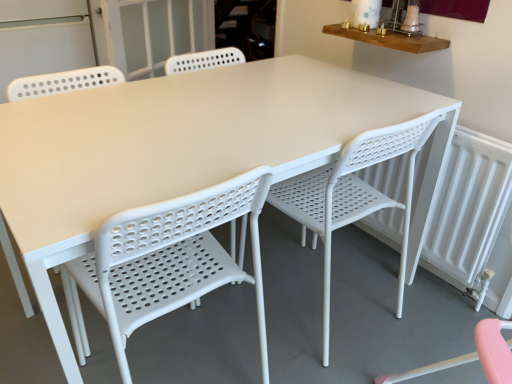
Question: Is white perforated plastic chair at center, arranged as the 2th chair when viewed from the right, far away from transparent glass screen door at upper center, marked as the 2th screen door in a left-to-right arrangement?

Choices:
 (A) no
 (B) yes

Answer: (B)

Question: Is white perforated plastic chair at center, arranged as the 2th chair when viewed from the right, outside transparent glass screen door at upper center, marked as the 2th screen door in a left-to-right arrangement?

Choices:
 (A) yes
 (B) no

Answer: (A)

Question: Can you confirm if white perforated plastic chair at center, arranged as the first chair when viewed from the left, is positioned to the right of transparent glass screen door at upper center, marked as the 2th screen door in a left-to-right arrangement?

Choices:
 (A) yes
 (B) no

Answer: (A)

Question: Is white perforated plastic chair at center, arranged as the 2th chair when viewed from the right, turned away from transparent glass screen door at upper center, marked as the 2th screen door in a left-to-right arrangement?

Choices:
 (A) yes
 (B) no

Answer: (B)

Question: Is transparent glass screen door at upper center, the first screen door from the right, a part of white perforated plastic chair at center, arranged as the first chair when viewed from the left?

Choices:
 (A) yes
 (B) no

Answer: (B)

Question: Relative to transparent glass screen door at upper center, the first screen door from the right, is white perforated plastic chair at center, arranged as the 2th chair when viewed from the right, in front or behind?

Choices:
 (A) behind
 (B) front

Answer: (B)

Question: Is point click(188, 228) closer or farther from the camera than point click(121, 4)?

Choices:
 (A) closer
 (B) farther

Answer: (A)

Question: From the image's perspective, is white perforated plastic chair at center, arranged as the 2th chair when viewed from the right, located above or below transparent glass screen door at upper center, the first screen door from the right?

Choices:
 (A) below
 (B) above

Answer: (A)

Question: Is white perforated plastic chair at center, arranged as the first chair when viewed from the left, spatially inside transparent glass screen door at upper center, marked as the 2th screen door in a left-to-right arrangement, or outside of it?

Choices:
 (A) inside
 (B) outside

Answer: (B)

Question: Considering the relative positions of transparent glass screen door at upper center, the first screen door from the right, and white perforated screen door at upper left, placed as the first screen door when sorted from left to right, in the image provided, is transparent glass screen door at upper center, the first screen door from the right, to the left or to the right of white perforated screen door at upper left, placed as the first screen door when sorted from left to right,?

Choices:
 (A) right
 (B) left

Answer: (A)

Question: From a real-world perspective, is transparent glass screen door at upper center, marked as the 2th screen door in a left-to-right arrangement, positioned above or below white perforated screen door at upper left, placed as the first screen door when sorted from left to right?

Choices:
 (A) below
 (B) above

Answer: (B)

Question: Is transparent glass screen door at upper center, the first screen door from the right, taller or shorter than white perforated screen door at upper left, the second screen door in the right-to-left sequence?

Choices:
 (A) tall
 (B) short

Answer: (B)

Question: From the image's perspective, is transparent glass screen door at upper center, marked as the 2th screen door in a left-to-right arrangement, positioned above or below white perforated screen door at upper left, the second screen door in the right-to-left sequence?

Choices:
 (A) above
 (B) below

Answer: (A)

Question: Considering the positions of point (300, 205) and point (184, 236), is point (300, 205) closer or farther from the camera than point (184, 236)?

Choices:
 (A) farther
 (B) closer

Answer: (A)

Question: From the image's perspective, is white plastic chair at center, placed as the second chair when sorted from left to right, positioned above or below white perforated plastic chair at center, arranged as the first chair when viewed from the left?

Choices:
 (A) above
 (B) below

Answer: (A)